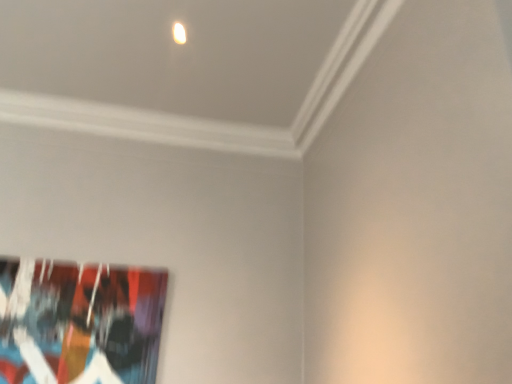
Question: Is matte white light at upper center not near abstract painting at lower left?

Choices:
 (A) no
 (B) yes

Answer: (B)

Question: Is matte white light at upper center further to the viewer compared to abstract painting at lower left?

Choices:
 (A) yes
 (B) no

Answer: (B)

Question: Is matte white light at upper center positioned with its back to abstract painting at lower left?

Choices:
 (A) yes
 (B) no

Answer: (B)

Question: Does matte white light at upper center have a smaller size compared to abstract painting at lower left?

Choices:
 (A) no
 (B) yes

Answer: (B)

Question: Can you confirm if matte white light at upper center is thinner than abstract painting at lower left?

Choices:
 (A) yes
 (B) no

Answer: (B)

Question: Is matte white light at upper center facing towards abstract painting at lower left?

Choices:
 (A) yes
 (B) no

Answer: (B)

Question: Can you confirm if abstract painting at lower left is positioned to the right of matte white light at upper center?

Choices:
 (A) no
 (B) yes

Answer: (A)

Question: Is abstract painting at lower left in contact with matte white light at upper center?

Choices:
 (A) no
 (B) yes

Answer: (A)

Question: Considering the relative sizes of abstract painting at lower left and matte white light at upper center in the image provided, is abstract painting at lower left shorter than matte white light at upper center?

Choices:
 (A) no
 (B) yes

Answer: (A)

Question: Is abstract painting at lower left positioned before matte white light at upper center?

Choices:
 (A) no
 (B) yes

Answer: (A)

Question: Does abstract painting at lower left have a greater width compared to matte white light at upper center?

Choices:
 (A) no
 (B) yes

Answer: (A)

Question: Is matte white light at upper center located within abstract painting at lower left?

Choices:
 (A) no
 (B) yes

Answer: (A)

Question: Does point (120, 365) appear closer or farther from the camera than point (179, 23)?

Choices:
 (A) farther
 (B) closer

Answer: (A)